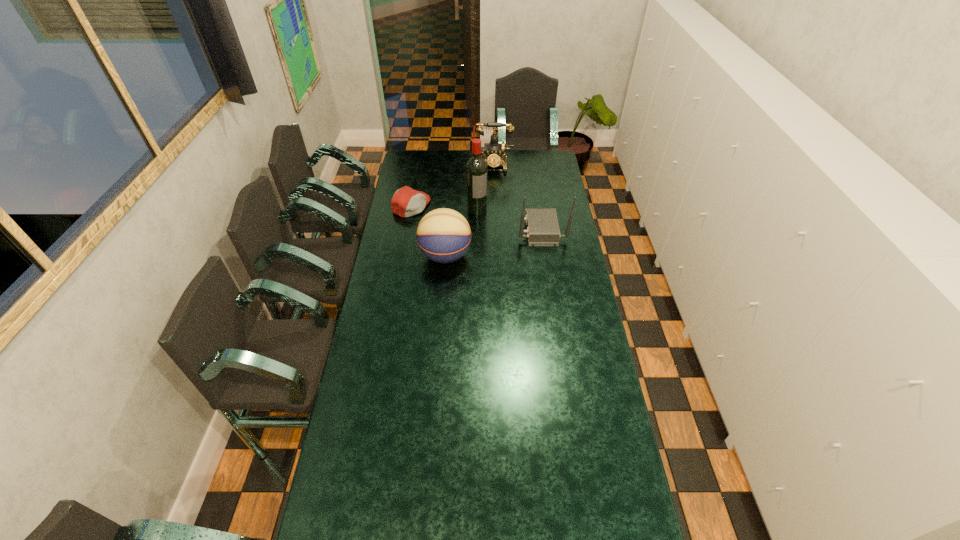
You are a GUI agent. You are given a task and a screenshot of the screen. Output one action in this format:
    pyautogui.click(x=<x>, y=<y>)
    Task: Click on the basketball
    This screenshot has height=540, width=960.
    Given the screenshot: What is the action you would take?
    pyautogui.click(x=443, y=235)

You are a GUI agent. You are given a task and a screenshot of the screen. Output one action in this format:
    pyautogui.click(x=<x>, y=<y>)
    Task: Click on the router
    The width and height of the screenshot is (960, 540).
    Given the screenshot: What is the action you would take?
    pyautogui.click(x=542, y=225)

Image resolution: width=960 pixels, height=540 pixels. In order to click on telephone in this screenshot , I will do `click(493, 150)`.

In order to click on cap in this screenshot , I will do `click(406, 202)`.

I want to click on wine bottle, so click(x=476, y=169).

This screenshot has width=960, height=540. In order to click on vacant space located on the patterned surface of the basketball in this screenshot , I will do `click(487, 256)`.

This screenshot has height=540, width=960. What are the coordinates of `free point located on the back of the router to connect cables` in the screenshot? It's located at (499, 230).

Where is `vacant space situated 0.090m on the back of the router to connect cables`? Image resolution: width=960 pixels, height=540 pixels. vacant space situated 0.090m on the back of the router to connect cables is located at coordinates (499, 230).

You are a GUI agent. You are given a task and a screenshot of the screen. Output one action in this format:
    pyautogui.click(x=<x>, y=<y>)
    Task: Click on the vacant space situated 0.320m on the back of the router to connect cables
    
    Given the screenshot: What is the action you would take?
    pyautogui.click(x=453, y=230)

Identify the location of vacant space located 0.080m on the front of the telephone, featuring the rotary dial. Image resolution: width=960 pixels, height=540 pixels. (492, 181).